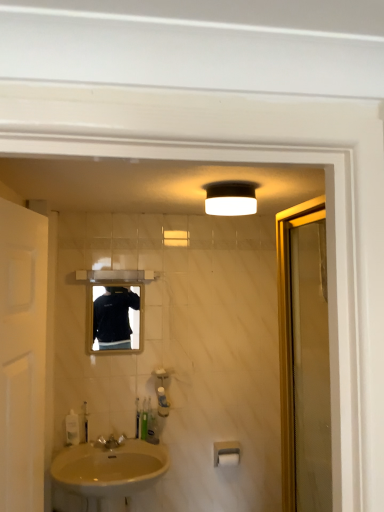
Question: Choose the correct answer: Is translucent plastic soap dispenser at lower left inside green plastic toothbrush at lower center, which ranks as the fourth toiletry in left-to-right order, or outside it?

Choices:
 (A) inside
 (B) outside

Answer: (B)

Question: From a real-world perspective, is translucent plastic soap dispenser at lower left physically located above or below green plastic toothbrush at lower center, which ranks as the fourth toiletry in left-to-right order?

Choices:
 (A) above
 (B) below

Answer: (A)

Question: Estimate the real-world distances between objects in this image. Which object is farther from the white matte toilet paper at lower center?

Choices:
 (A) white matte door at left
 (B) black matte mirror at center
 (C) silver metallic faucet at lower center
 (D) green plastic toothbrush at lower center, the second toiletry viewed from the right
 (E) white matte light fixture at upper center

Answer: (A)

Question: Estimate the real-world distances between objects in this image. Which object is closer to the silver metallic faucet at lower center?

Choices:
 (A) translucent plastic toothbrush at lower center, the 5th toiletry in the left-to-right sequence
 (B) clear plastic bottle at lower left, the 1th toiletry when ordered from left to right
 (C) translucent plastic soap dispenser at lower center, the 3th toiletry viewed from the left
 (D) green plastic toothbrush at lower center, which ranks as the second toiletry in left-to-right order
 (E) white matte light fixture at upper center

Answer: (D)